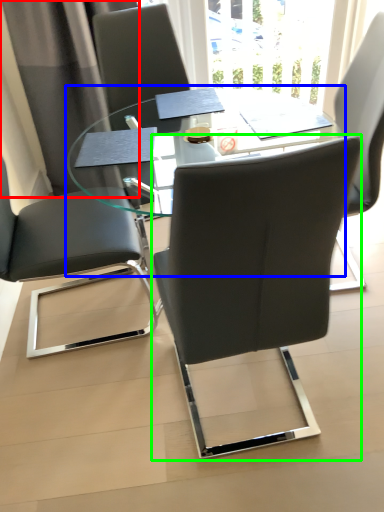
Question: Based on their relative distances, which object is nearer to curtain (highlighted by a red box)? Choose from table (highlighted by a blue box) and chair (highlighted by a green box).

Choices:
 (A) table
 (B) chair

Answer: (A)